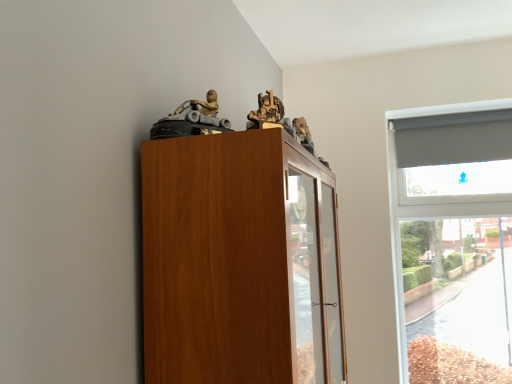
The image size is (512, 384). Find the location of `wooden cabinet at upper left`. wooden cabinet at upper left is located at coordinates (239, 262).

Locate an element on the screen. wooden figure at upper center, the 2th toy viewed from the left is located at coordinates (267, 110).

Describe the element at coordinates (192, 120) in the screenshot. The height and width of the screenshot is (384, 512). I see `matte gray plastic toy car at upper center, which ranks as the first toy in left-to-right order` at that location.

The width and height of the screenshot is (512, 384). What are the coordinates of `wooden cabinet at upper left` in the screenshot? It's located at (239, 262).

Can you confirm if matte gray plastic toy car at upper center, which is counted as the second toy, starting from the right, is taller than wooden figure at upper center, the 2th toy viewed from the left?

Yes.

From a real-world perspective, is matte gray plastic toy car at upper center, which ranks as the first toy in left-to-right order, positioned over wooden figure at upper center, the 2th toy viewed from the left, based on gravity?

Actually, matte gray plastic toy car at upper center, which ranks as the first toy in left-to-right order, is physically below wooden figure at upper center, the 2th toy viewed from the left, in the real world.

Is matte gray plastic toy car at upper center, which ranks as the first toy in left-to-right order, aimed at wooden figure at upper center, the first toy in the right-to-left sequence?

Yes, matte gray plastic toy car at upper center, which ranks as the first toy in left-to-right order, faces towards wooden figure at upper center, the first toy in the right-to-left sequence.

In terms of size, does matte gray plastic toy car at upper center, which ranks as the first toy in left-to-right order, appear bigger or smaller than wooden figure at upper center, the first toy in the right-to-left sequence?

Considering their sizes, matte gray plastic toy car at upper center, which ranks as the first toy in left-to-right order, takes up more space than wooden figure at upper center, the first toy in the right-to-left sequence.

Is wooden figure at upper center, the 2th toy viewed from the left, placed right next to matte gray plastic toy car at upper center, which ranks as the first toy in left-to-right order?

No, wooden figure at upper center, the 2th toy viewed from the left, is not beside matte gray plastic toy car at upper center, which ranks as the first toy in left-to-right order.

Looking at this image, which of these two, wooden figure at upper center, the 2th toy viewed from the left, or matte gray plastic toy car at upper center, which is counted as the second toy, starting from the right, is wider?

matte gray plastic toy car at upper center, which is counted as the second toy, starting from the right.

Consider the image. From a real-world perspective, is wooden figure at upper center, the first toy in the right-to-left sequence, physically located above or below matte gray plastic toy car at upper center, which ranks as the first toy in left-to-right order?

wooden figure at upper center, the first toy in the right-to-left sequence, is above matte gray plastic toy car at upper center, which ranks as the first toy in left-to-right order.

Is wooden figure at upper center, the 2th toy viewed from the left, beside wooden cabinet at upper left?

wooden figure at upper center, the 2th toy viewed from the left, is not next to wooden cabinet at upper left, and they're not touching.

Does wooden figure at upper center, the first toy in the right-to-left sequence, contain wooden cabinet at upper left?

Answer: No, wooden cabinet at upper left is not surrounded by wooden figure at upper center, the first toy in the right-to-left sequence.

Which object is closer to the camera, wooden figure at upper center, the 2th toy viewed from the left, or wooden cabinet at upper left?

wooden cabinet at upper left is closer to the camera.

Is wooden figure at upper center, the 2th toy viewed from the left, facing away from wooden cabinet at upper left?

No, wooden figure at upper center, the 2th toy viewed from the left, is not facing away from wooden cabinet at upper left.

In the image, is wooden cabinet at upper left positioned in front of or behind wooden figure at upper center, the first toy in the right-to-left sequence?

Clearly, wooden cabinet at upper left is in front of wooden figure at upper center, the first toy in the right-to-left sequence.

Which object is positioned more to the left, wooden cabinet at upper left or wooden figure at upper center, the first toy in the right-to-left sequence?

Positioned to the left is wooden figure at upper center, the first toy in the right-to-left sequence.

From the image's perspective, which one is positioned lower, wooden cabinet at upper left or wooden figure at upper center, the first toy in the right-to-left sequence?

From the image's view, wooden cabinet at upper left is below.

Identify the location of cupboard below the wooden figure at upper center, the 2th toy viewed from the left (from a real-world perspective). The height and width of the screenshot is (384, 512). (239, 262).

Is wooden cabinet at upper left to the left of matte gray plastic toy car at upper center, which is counted as the second toy, starting from the right, from the viewer's perspective?

No.

Is wooden cabinet at upper left oriented away from matte gray plastic toy car at upper center, which is counted as the second toy, starting from the right?

No, matte gray plastic toy car at upper center, which is counted as the second toy, starting from the right, is not at the back of wooden cabinet at upper left.

Considering the relative sizes of wooden cabinet at upper left and matte gray plastic toy car at upper center, which is counted as the second toy, starting from the right, in the image provided, is wooden cabinet at upper left thinner than matte gray plastic toy car at upper center, which is counted as the second toy, starting from the right,?

No, wooden cabinet at upper left is not thinner than matte gray plastic toy car at upper center, which is counted as the second toy, starting from the right.

From a real-world perspective, which object rests below the other?

wooden cabinet at upper left, from a real-world perspective.

Does point (163, 120) appear closer or farther from the camera than point (233, 157)?

Point (163, 120) is farther from the camera than point (233, 157).

Are matte gray plastic toy car at upper center, which ranks as the first toy in left-to-right order, and wooden cabinet at upper left far apart?

matte gray plastic toy car at upper center, which ranks as the first toy in left-to-right order, is actually quite close to wooden cabinet at upper left.

The width and height of the screenshot is (512, 384). Identify the location of toy that is the 1st object above the wooden cabinet at upper left (from a real-world perspective). (192, 120).

From a real-world perspective, between matte gray plastic toy car at upper center, which is counted as the second toy, starting from the right, and wooden cabinet at upper left, who is vertically higher?

matte gray plastic toy car at upper center, which is counted as the second toy, starting from the right, from a real-world perspective.

Identify the location of toy lying below the wooden figure at upper center, the 2th toy viewed from the left (from the image's perspective). Image resolution: width=512 pixels, height=384 pixels. (192, 120).

Locate an element on the screen. toy that is above the matte gray plastic toy car at upper center, which ranks as the first toy in left-to-right order (from the image's perspective) is located at coordinates (267, 110).

Looking at the image, which one is located further to wooden cabinet at upper left, wooden figure at upper center, the 2th toy viewed from the left, or matte gray plastic toy car at upper center, which ranks as the first toy in left-to-right order?

Among the two, wooden figure at upper center, the 2th toy viewed from the left, is located further to wooden cabinet at upper left.

From the image, which object appears to be nearer to wooden cabinet at upper left, matte gray plastic toy car at upper center, which is counted as the second toy, starting from the right, or wooden figure at upper center, the 2th toy viewed from the left?

matte gray plastic toy car at upper center, which is counted as the second toy, starting from the right, is positioned closer to the anchor wooden cabinet at upper left.

Looking at the image, which one is located closer to wooden figure at upper center, the first toy in the right-to-left sequence, matte gray plastic toy car at upper center, which ranks as the first toy in left-to-right order, or wooden cabinet at upper left?

The object closer to wooden figure at upper center, the first toy in the right-to-left sequence, is matte gray plastic toy car at upper center, which ranks as the first toy in left-to-right order.

From the image, which object appears to be farther from wooden figure at upper center, the 2th toy viewed from the left, wooden cabinet at upper left or matte gray plastic toy car at upper center, which ranks as the first toy in left-to-right order?

wooden cabinet at upper left.

From the image, which object appears to be farther from matte gray plastic toy car at upper center, which ranks as the first toy in left-to-right order, wooden cabinet at upper left or wooden figure at upper center, the first toy in the right-to-left sequence?

wooden cabinet at upper left.

Considering their positions, is wooden figure at upper center, the 2th toy viewed from the left, positioned further to matte gray plastic toy car at upper center, which is counted as the second toy, starting from the right, than wooden cabinet at upper left?

Among the two, wooden cabinet at upper left is located further to matte gray plastic toy car at upper center, which is counted as the second toy, starting from the right.

The height and width of the screenshot is (384, 512). What are the coordinates of `toy between wooden figure at upper center, the 2th toy viewed from the left, and wooden cabinet at upper left vertically` in the screenshot? It's located at (192, 120).